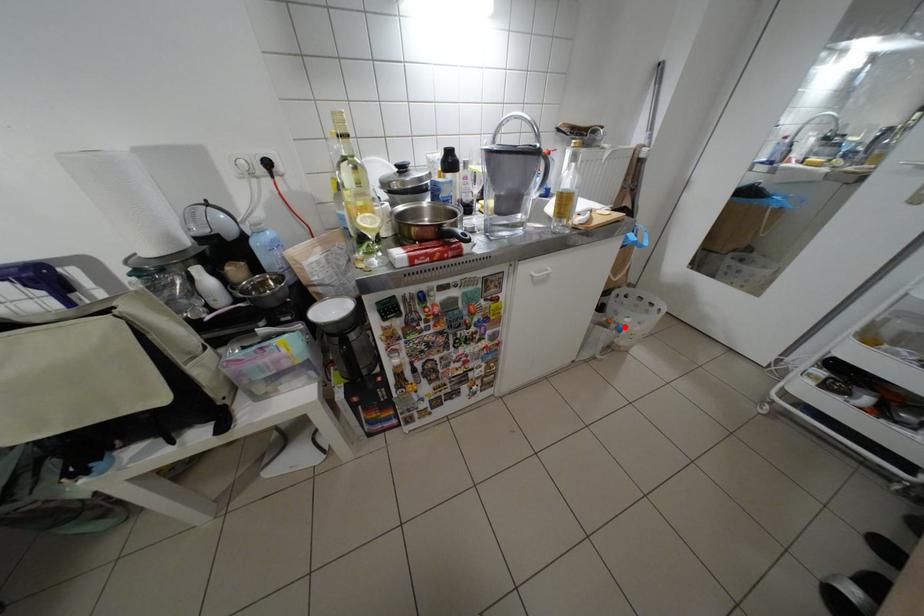
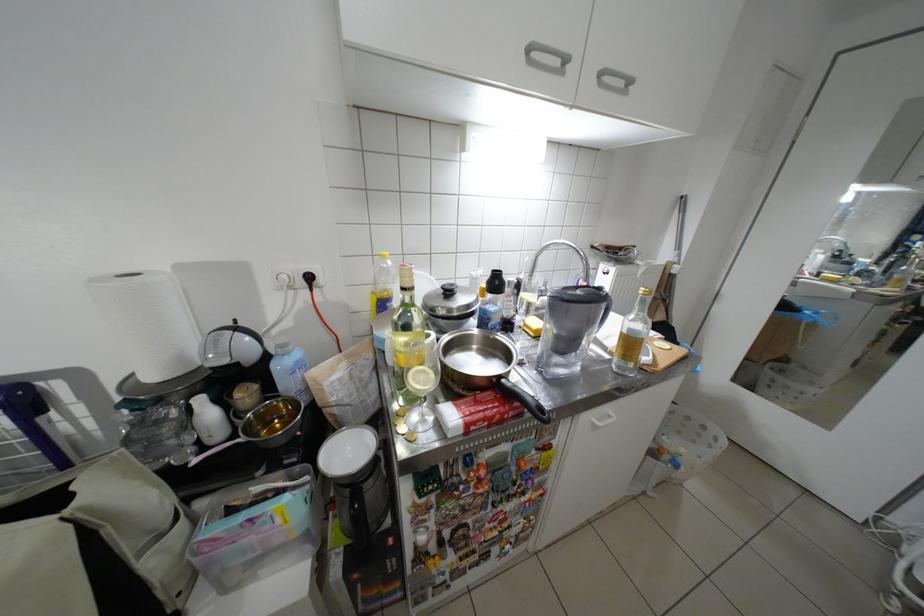
Where in the second image is the point corresponding to the highlighted location from the first image?

(677, 458)